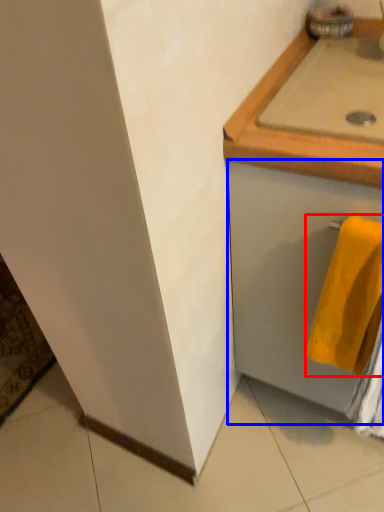
Question: Which object appears farthest to the camera in this image, towel (highlighted by a red box) or drawer (highlighted by a blue box)?

Choices:
 (A) towel
 (B) drawer

Answer: (A)